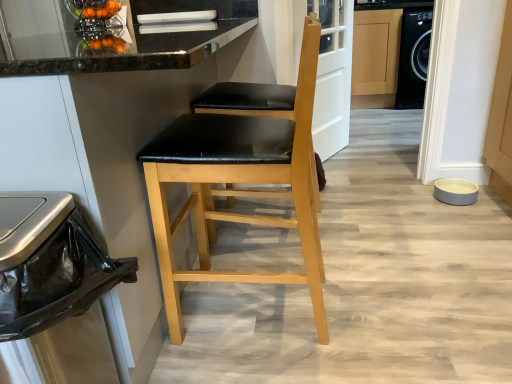
Question: Does metallic trash can at left have a larger size compared to matte black seat at center, the 1th chair from the back?

Choices:
 (A) yes
 (B) no

Answer: (B)

Question: Is metallic trash can at left in contact with matte black seat at center, which is counted as the 2th chair, starting from the front?

Choices:
 (A) yes
 (B) no

Answer: (B)

Question: Is metallic trash can at left outside matte black seat at center, which is counted as the 2th chair, starting from the front?

Choices:
 (A) yes
 (B) no

Answer: (A)

Question: Is metallic trash can at left at the left side of matte black seat at center, which is counted as the 2th chair, starting from the front?

Choices:
 (A) no
 (B) yes

Answer: (B)

Question: From a real-world perspective, is metallic trash can at left positioned under matte black seat at center, the 1th chair from the back, based on gravity?

Choices:
 (A) yes
 (B) no

Answer: (A)

Question: Considering the relative positions of matte black seat at center, which is counted as the 2th chair, starting from the front, and metallic silver fruit bowl at upper left, which is the first appliance from left to right, in the image provided, is matte black seat at center, which is counted as the 2th chair, starting from the front, to the left or to the right of metallic silver fruit bowl at upper left, which is the first appliance from left to right,?

Choices:
 (A) left
 (B) right

Answer: (B)

Question: In the image, is matte black seat at center, the 1th chair from the back, positioned in front of or behind metallic silver fruit bowl at upper left, the first appliance when ordered from top to bottom?

Choices:
 (A) behind
 (B) front

Answer: (B)

Question: Is point (216, 96) positioned closer to the camera than point (82, 11)?

Choices:
 (A) closer
 (B) farther

Answer: (A)

Question: From the image's perspective, relative to metallic silver fruit bowl at upper left, the second appliance positioned from the bottom, is matte black seat at center, the 1th chair from the back, above or below?

Choices:
 (A) above
 (B) below

Answer: (B)

Question: In terms of height, does matte wood cabinet at center look taller or shorter compared to gray matte pet bowl at lower right, arranged as the first appliance when viewed from the right?

Choices:
 (A) short
 (B) tall

Answer: (B)

Question: In the image, is matte wood cabinet at center positioned in front of or behind gray matte pet bowl at lower right, which is the first appliance in bottom-to-top order?

Choices:
 (A) behind
 (B) front

Answer: (A)

Question: Is matte wood cabinet at center wider or thinner than gray matte pet bowl at lower right, which is the first appliance in bottom-to-top order?

Choices:
 (A) thin
 (B) wide

Answer: (B)

Question: Considering the relative positions of matte wood cabinet at center and gray matte pet bowl at lower right, arranged as the 2th appliance when viewed from the top, in the image provided, is matte wood cabinet at center to the left or to the right of gray matte pet bowl at lower right, arranged as the 2th appliance when viewed from the top,?

Choices:
 (A) left
 (B) right

Answer: (B)

Question: Is gray matte pet bowl at lower right, which is the first appliance in bottom-to-top order, taller or shorter than matte black seat at center, which is counted as the 2th chair, starting from the front?

Choices:
 (A) short
 (B) tall

Answer: (A)

Question: Does point pyautogui.click(x=468, y=196) appear closer or farther from the camera than point pyautogui.click(x=316, y=203)?

Choices:
 (A) closer
 (B) farther

Answer: (B)